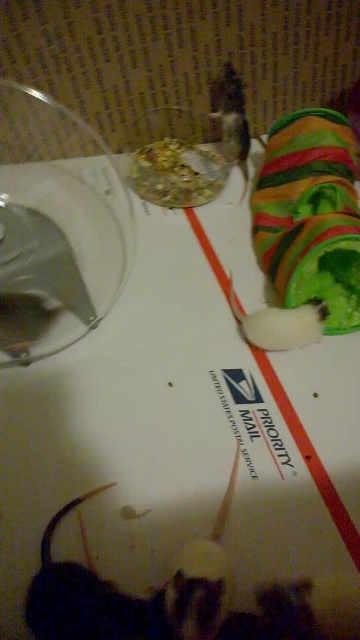
You are observing the rodent in its habitat. There are two points marked in the scene. The first point is at coordinate point(128, 172) and the second point is at point(356, 536). Which point is closer to you?

Point(128, 172) is further to the camera than point(356, 536). Therefore, point(356, 536) is closer to you.

You are a pet rodent in a habitat. You see a shiny metallic food at center and a white paper at center. Which one is closer to you?

The shiny metallic food at center is 6.54 inches away from the white paper at center, so whichever is closer depends on your position. However, since both are at center, they are equidistant from you.

You are a pet rodent in the habitat. You want to reach the shiny metallic food at center without stepping off the white paper at center. Is this possible?

Yes, because the shiny metallic food at center is positioned over the white paper at center, so you can reach it while staying on the white paper at center.